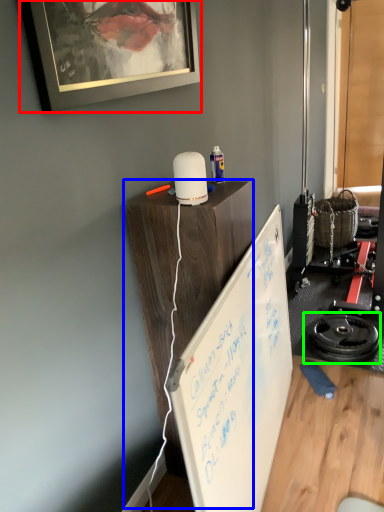
Question: Estimate the real-world distances between objects in this image. Which object is closer to picture frame (highlighted by a red box), table (highlighted by a blue box) or wheel (highlighted by a green box)?

Choices:
 (A) table
 (B) wheel

Answer: (A)